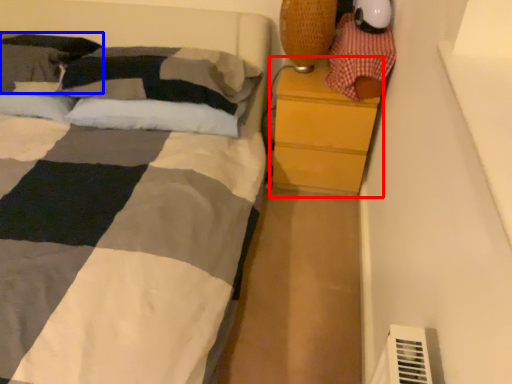
Question: Which object appears closest to the camera in this image, chest of drawers (highlighted by a red box) or pillow (highlighted by a blue box)?

Choices:
 (A) chest of drawers
 (B) pillow

Answer: (A)